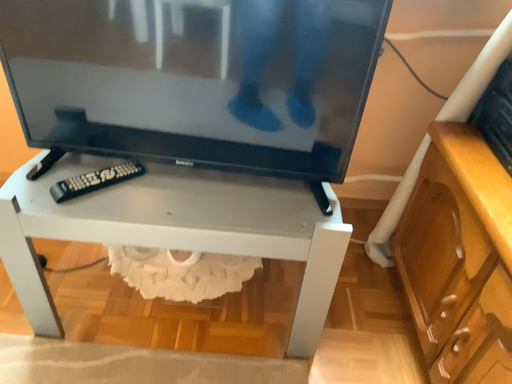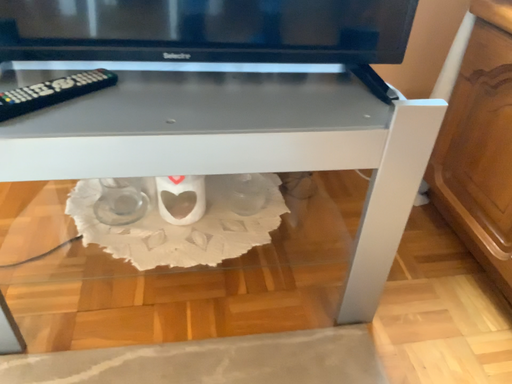
Question: How did the camera likely rotate when shooting the video?

Choices:
 (A) rotated right
 (B) rotated left

Answer: (A)